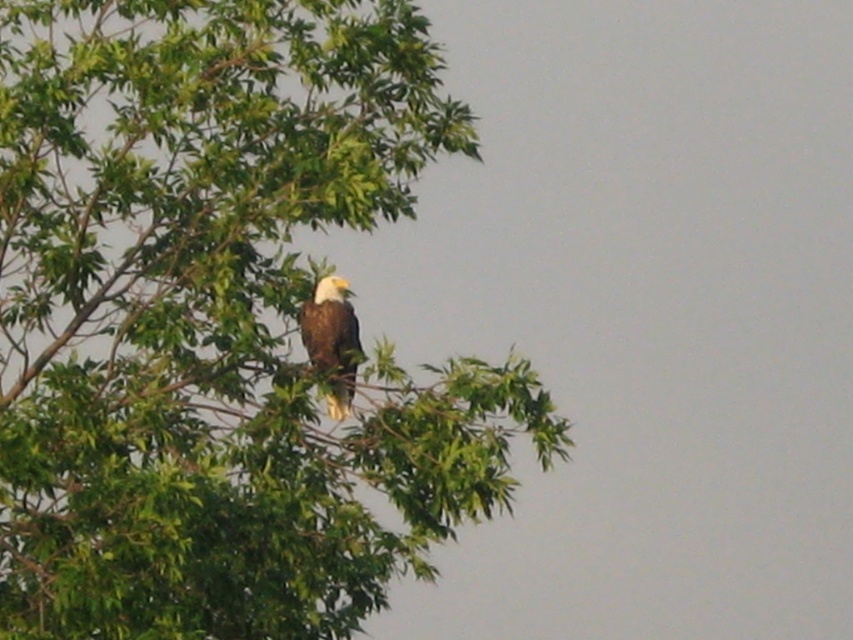
Based on the scene description, what is the 2D coordinate of the green leafy tree at upper left?

The green leafy tree at upper left is located at the 2D coordinate point of (216, 321).

You are a photographer standing 10 meters away from the camera. You want to take a photo of the green leafy tree at upper left. Can you move closer to the tree to get a better shot?

The green leafy tree at upper left and camera are 12.04 meters apart from each other. Since you are already 10 meters away from the camera, you are 2.04 meters away from the tree. Therefore, you can move closer to the green leafy tree at upper left to get a better shot.

You are a birdwatcher standing on the ground looking up at the green leafy tree at upper left and the white feathered eagle at upper center. Which object is higher in the scene?

The green leafy tree at upper left is positioned over the white feathered eagle at upper center, so the green leafy tree at upper left is higher in the scene.